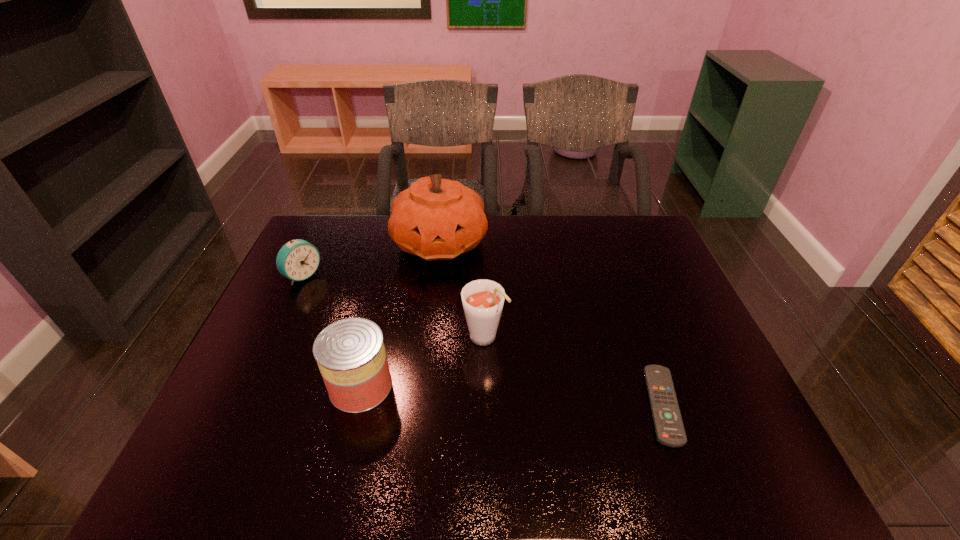
Find the location of a particular element. This screenshot has width=960, height=540. the third shortest object is located at coordinates (350, 353).

Where is `the shortest object`? the shortest object is located at coordinates (669, 428).

Locate an element on the screen. The height and width of the screenshot is (540, 960). the rightmost object is located at coordinates (669, 428).

Find the location of a particular element. pumpkin is located at coordinates (437, 219).

Locate an element on the screen. the fourth tallest object is located at coordinates (297, 260).

At what (x,y) coordinates should I click in order to perform the action: click on the leftmost object. Please return your answer as a coordinate pair (x, y). This screenshot has height=540, width=960. Looking at the image, I should click on (297, 260).

Find the location of a particular element. The image size is (960, 540). root beer is located at coordinates (482, 299).

The height and width of the screenshot is (540, 960). Find the location of `the fourth shortest object`. the fourth shortest object is located at coordinates (482, 299).

Where is `free point located on the back of the third shortest object`? The width and height of the screenshot is (960, 540). free point located on the back of the third shortest object is located at coordinates (384, 291).

This screenshot has width=960, height=540. Identify the location of free space located on the back of the rightmost object. (613, 268).